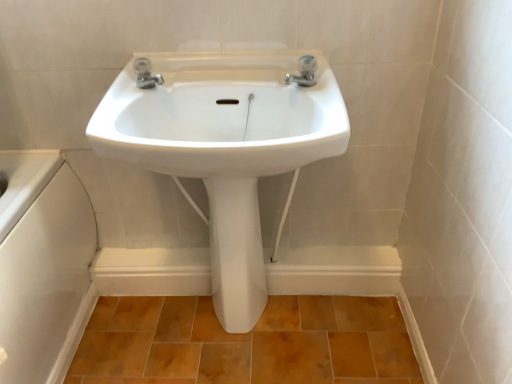
Image resolution: width=512 pixels, height=384 pixels. I want to click on free space in front of white glossy pedestal at center, so coord(238,360).